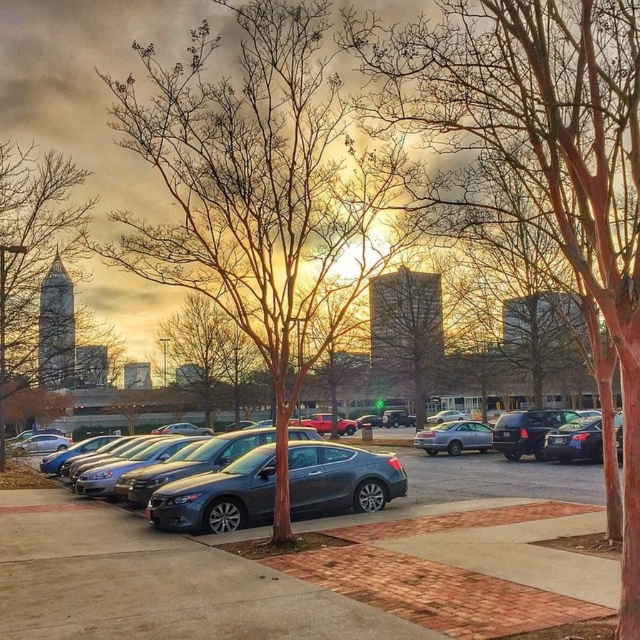
Question: Is satin gray sedan at center to the right of bare branches at center from the viewer's perspective?

Choices:
 (A) no
 (B) yes

Answer: (B)

Question: Which of the following is the closest to the observer?

Choices:
 (A) satin gray sedan at center
 (B) matte black sedan at center

Answer: (A)

Question: Which of the following is the farthest from the observer?

Choices:
 (A) (49, 236)
 (B) (572, 436)

Answer: (A)

Question: Which of the following is the closest to the observer?

Choices:
 (A) smooth brown tree trunk at left
 (B) shiny black sedan at right
 (C) smooth reddish-brown trunk at center

Answer: (C)

Question: Can you confirm if brown bark tree at center is smaller than metallic red truck at center?

Choices:
 (A) no
 (B) yes

Answer: (A)

Question: Where is smooth brown tree trunk at left located in relation to satin gray sedan at center in the image?

Choices:
 (A) right
 (B) left

Answer: (B)